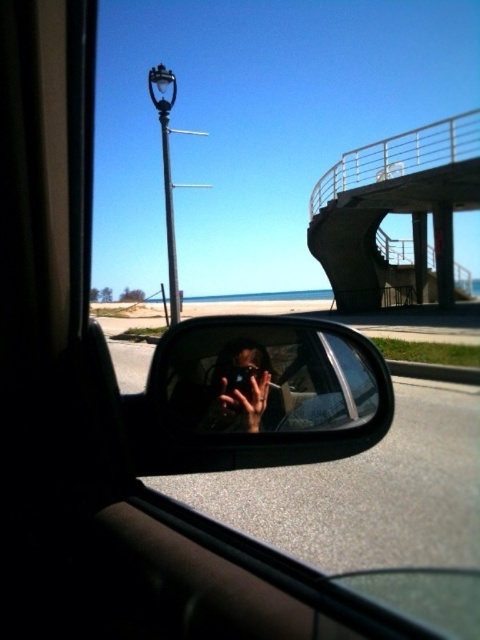
Who is lower down, concrete/stone overpass at upper right or clear plastic mirror at center?

Positioned lower is clear plastic mirror at center.

Locate an element on the screen. The image size is (480, 640). concrete/stone overpass at upper right is located at coordinates (395, 209).